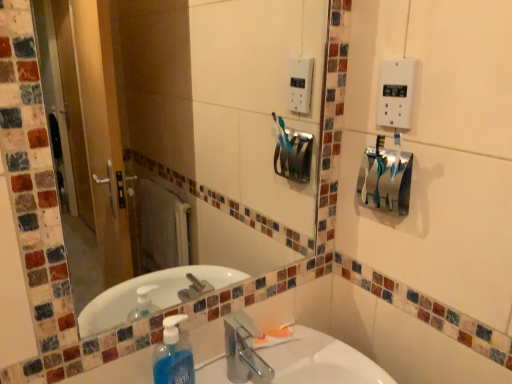
Question: Is clear glass mirror at upper center bigger or smaller than translucent orange tube at sink?

Choices:
 (A) small
 (B) big

Answer: (B)

Question: Would you say clear glass mirror at upper center is inside or outside translucent orange tube at sink?

Choices:
 (A) outside
 (B) inside

Answer: (A)

Question: Based on their relative distances, which object is nearer to the clear glass mirror at upper center?

Choices:
 (A) translucent orange tube at sink
 (B) blue translucent liquid soap at lower left
 (C) white plastic light switch at upper right
 (D) metallic silver hand dryer at upper right
 (E) white glossy sink at lower center

Answer: (E)

Question: Which is farther from the white plastic light switch at upper right?

Choices:
 (A) translucent orange tube at sink
 (B) clear glass mirror at upper center
 (C) blue translucent liquid soap at lower left
 (D) white glossy sink at lower center
 (E) metallic silver hand dryer at upper right

Answer: (B)